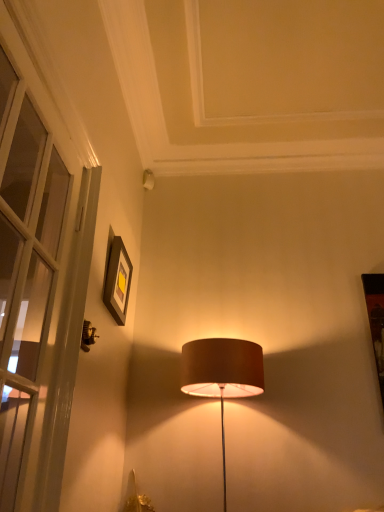
Question: From the image's perspective, is matte black picture frame at upper left positioned above or below white glass door at left?

Choices:
 (A) above
 (B) below

Answer: (B)

Question: Visually, is matte black picture frame at upper left positioned to the left or to the right of white glass door at left?

Choices:
 (A) right
 (B) left

Answer: (A)

Question: Is matte black picture frame at upper left bigger or smaller than white glass door at left?

Choices:
 (A) big
 (B) small

Answer: (B)

Question: Relative to matte black picture frame at upper left, is white glass door at left in front or behind?

Choices:
 (A) front
 (B) behind

Answer: (A)

Question: Looking at their shapes, would you say white glass door at left is wider or thinner than matte black picture frame at upper left?

Choices:
 (A) thin
 (B) wide

Answer: (B)

Question: Considering the positions of white glass door at left and matte black picture frame at upper left in the image, is white glass door at left taller or shorter than matte black picture frame at upper left?

Choices:
 (A) tall
 (B) short

Answer: (A)

Question: Based on their positions, is white glass door at left located to the left or right of matte black picture frame at upper left?

Choices:
 (A) right
 (B) left

Answer: (B)